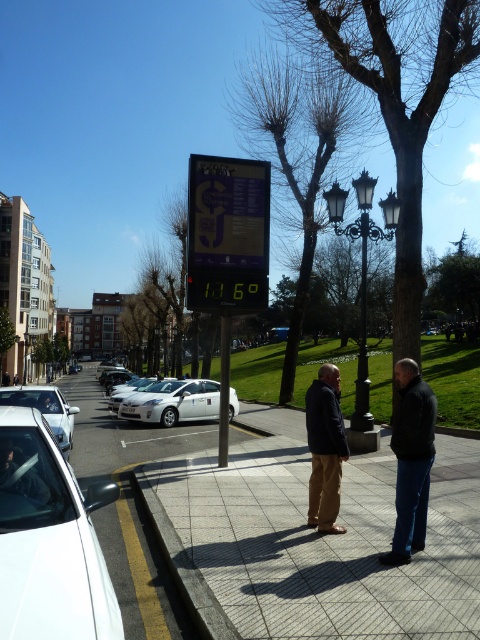
Between white glossy car at lower left and dark gray jacket at center, which one has less height?

white glossy car at lower left

Does white glossy car at lower left appear on the left side of dark gray jacket at center?

Indeed, white glossy car at lower left is positioned on the left side of dark gray jacket at center.

Who is more distant from viewer, (97, 600) or (419, 520)?

Positioned behind is point (419, 520).

At what (x,y) coordinates should I click in order to perform the action: click on white glossy car at lower left. Please return your answer as a coordinate pair (x, y). Looking at the image, I should click on (48, 540).

The height and width of the screenshot is (640, 480). Find the location of `white glossy sedan at lower left`. white glossy sedan at lower left is located at coordinates (46, 410).

Is white glossy sedan at lower left smaller than white glossy car at center?

No.

Describe the element at coordinates (46, 410) in the screenshot. The width and height of the screenshot is (480, 640). I see `white glossy sedan at lower left` at that location.

Find the location of a particular element. white glossy sedan at lower left is located at coordinates (46, 410).

This screenshot has height=640, width=480. What do you see at coordinates (48, 540) in the screenshot?
I see `white glossy car at lower left` at bounding box center [48, 540].

Is white glossy car at lower left above white glossy sedan at lower left?

Yes, white glossy car at lower left is above white glossy sedan at lower left.

Between point (24, 560) and point (46, 400), which one is positioned in front?

Point (24, 560) is more forward.

Where is `white glossy car at lower left`? The height and width of the screenshot is (640, 480). white glossy car at lower left is located at coordinates (48, 540).